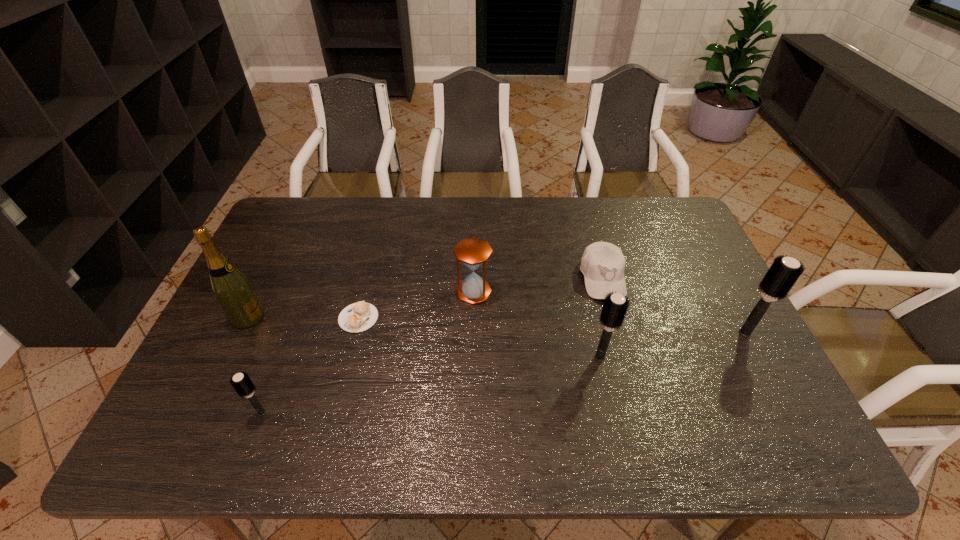
The image size is (960, 540). What are the coordinates of `the nearest hairbrush` in the screenshot? It's located at (241, 382).

Locate an element on the screen. the shortest hairbrush is located at coordinates point(241,382).

Locate an element on the screen. This screenshot has height=540, width=960. the third tallest object is located at coordinates (615, 306).

Locate an element on the screen. the sixth farthest object is located at coordinates (615, 306).

You are a GUI agent. You are given a task and a screenshot of the screen. Output one action in this format:
    pyautogui.click(x=<x>, y=<y>)
    Task: Click on the rightmost object
    Image resolution: width=960 pixels, height=540 pixels.
    Given the screenshot: What is the action you would take?
    pyautogui.click(x=784, y=272)

This screenshot has width=960, height=540. What are the coordinates of `the farthest hairbrush` in the screenshot? It's located at 784,272.

Find the location of a particular element. This screenshot has height=540, width=960. baseball cap is located at coordinates (602, 263).

Find the location of `the tallest object`. the tallest object is located at coordinates (231, 288).

Where is `wine bottle`? This screenshot has width=960, height=540. wine bottle is located at coordinates (231, 288).

Image resolution: width=960 pixels, height=540 pixels. Identify the location of the shortest object. (357, 317).